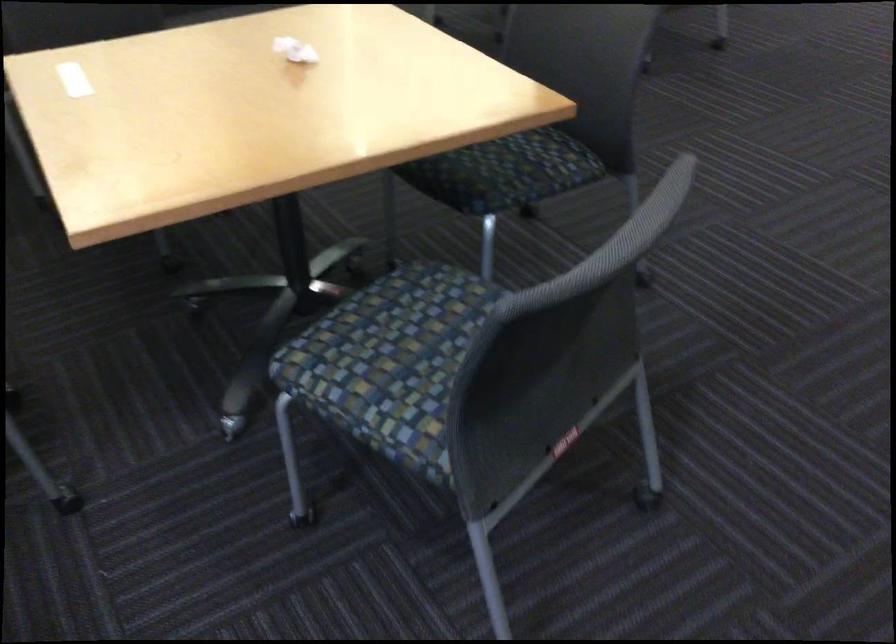
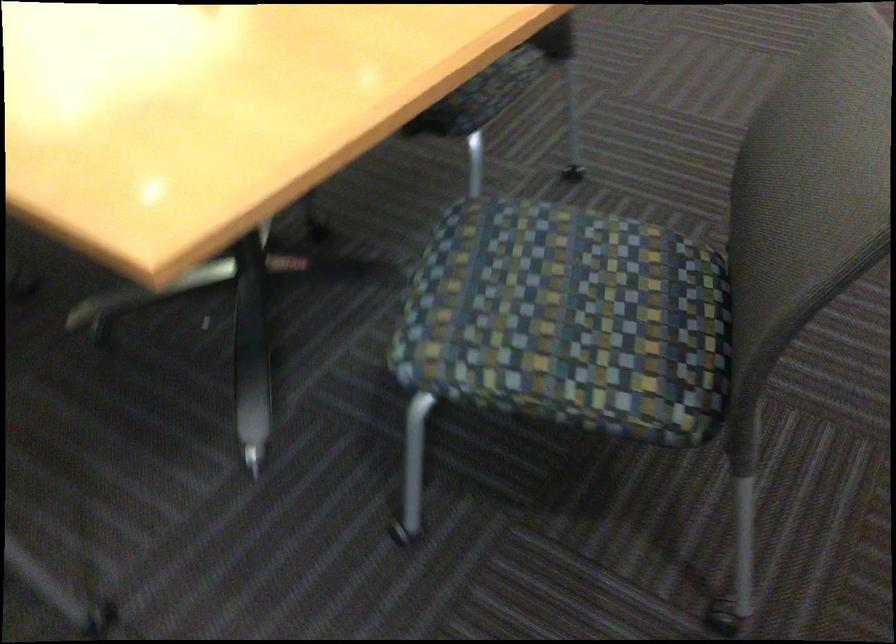
Question: The images are taken continuously from a first-person perspective. In which direction is your viewpoint rotating?

Choices:
 (A) Left
 (B) Right
 (C) Up
 (D) Down

Answer: (B)